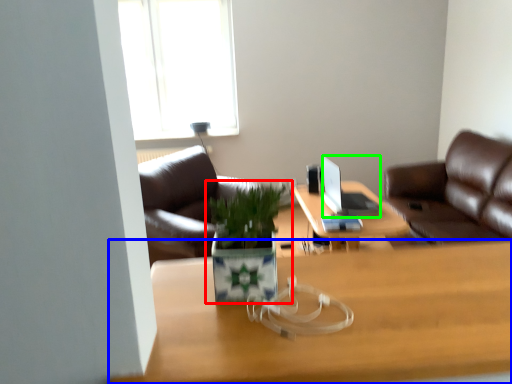
Question: Estimate the real-world distances between objects in this image. Which object is closer to houseplant (highlighted by a red box), desk (highlighted by a blue box) or laptop (highlighted by a green box)?

Choices:
 (A) desk
 (B) laptop

Answer: (A)